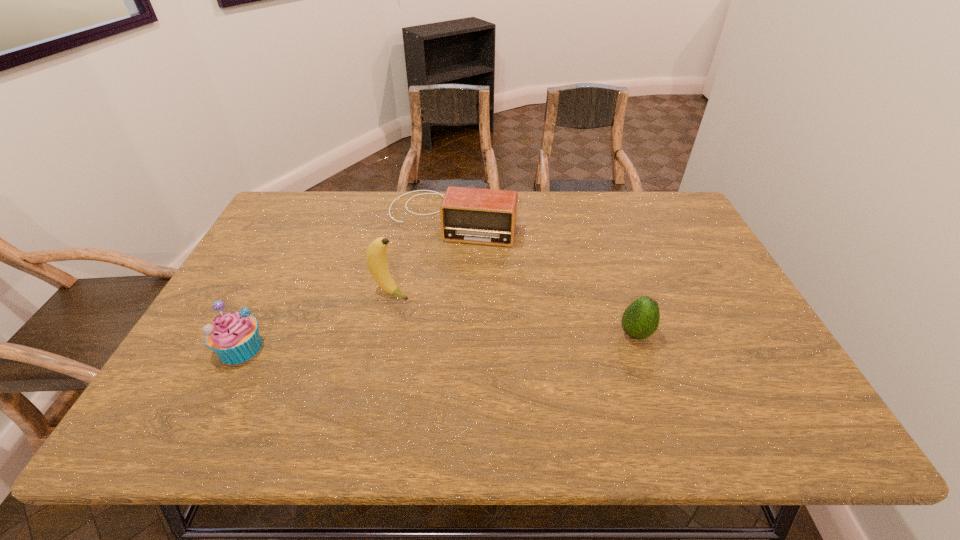
At what (x,y) coordinates should I click in order to perform the action: click on vacant point located on the front-facing side of the radio receiver. Please return your answer as a coordinate pair (x, y). The width and height of the screenshot is (960, 540). Looking at the image, I should click on (432, 267).

This screenshot has height=540, width=960. I want to click on free space located on the front-facing side of the radio receiver, so click(x=424, y=292).

The width and height of the screenshot is (960, 540). Find the location of `vacant area located on the front-facing side of the radio receiver`. vacant area located on the front-facing side of the radio receiver is located at coordinates (428, 279).

Find the location of a particular element. object that is at the far edge is located at coordinates (470, 215).

Identify the location of object at the near edge. (234, 337).

Find the location of a particular element. The width and height of the screenshot is (960, 540). object situated at the left edge is located at coordinates (234, 337).

You are a GUI agent. You are given a task and a screenshot of the screen. Output one action in this format:
    pyautogui.click(x=<x>, y=<y>)
    Task: Click on the object that is positioned at the near left corner
    
    Given the screenshot: What is the action you would take?
    (x=234, y=337)

Find the location of a particular element. The image size is (960, 540). vacant space at the far edge of the desktop is located at coordinates point(552,193).

In the image, there is a desktop. In order to click on vacant region at the near edge in this screenshot , I will do [x=640, y=373].

Locate an element on the screen. The width and height of the screenshot is (960, 540). free space at the left edge of the desktop is located at coordinates (301, 238).